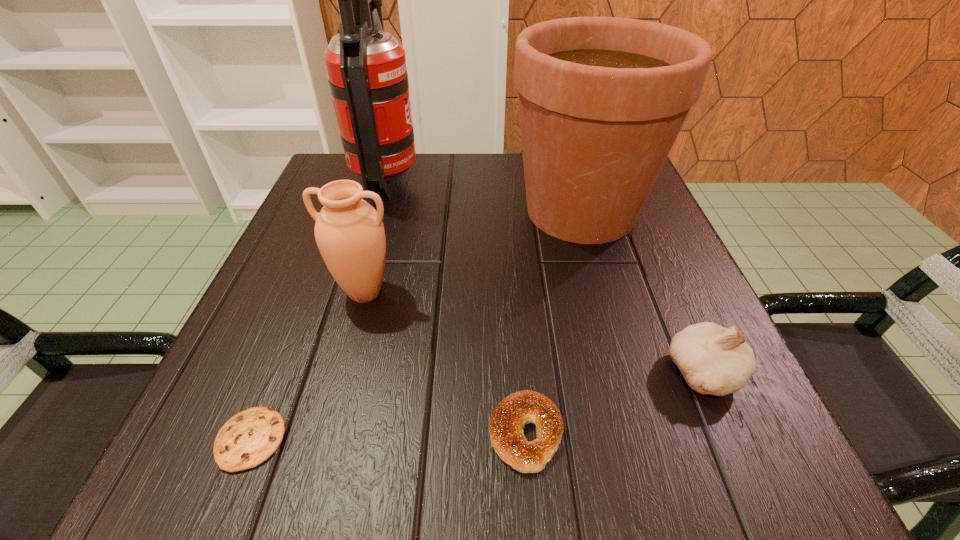
Identify the location of object that is the third nearest to the flowerpot. The width and height of the screenshot is (960, 540). (349, 232).

The height and width of the screenshot is (540, 960). I want to click on the fourth closest object relative to the flowerpot, so click(x=506, y=425).

The width and height of the screenshot is (960, 540). Find the location of `free point that satisfies the following two spatial constraints: 1. on the front side of the third tallest object; 2. on the left side of the fifth tallest object`. free point that satisfies the following two spatial constraints: 1. on the front side of the third tallest object; 2. on the left side of the fifth tallest object is located at coordinates (327, 434).

The height and width of the screenshot is (540, 960). Find the location of `vacant area that satisfies the following two spatial constraints: 1. on the back side of the second tallest object; 2. on the front label side of the fire extinguisher`. vacant area that satisfies the following two spatial constraints: 1. on the back side of the second tallest object; 2. on the front label side of the fire extinguisher is located at coordinates (571, 179).

This screenshot has width=960, height=540. Find the location of `free location that satisfies the following two spatial constraints: 1. on the back side of the bagel; 2. on the left side of the fourth tallest object`. free location that satisfies the following two spatial constraints: 1. on the back side of the bagel; 2. on the left side of the fourth tallest object is located at coordinates (521, 372).

Find the location of a particular element. The width and height of the screenshot is (960, 540). free space in the image that satisfies the following two spatial constraints: 1. on the back side of the third shortest object; 2. on the right side of the second shortest object is located at coordinates (521, 372).

Locate an element on the screen. Image resolution: width=960 pixels, height=540 pixels. free space in the image that satisfies the following two spatial constraints: 1. on the front label side of the fire extinguisher; 2. on the right side of the urn is located at coordinates (353, 293).

This screenshot has height=540, width=960. What are the coordinates of `vacant space that satisfies the following two spatial constraints: 1. on the back side of the flowerpot; 2. on the left side of the shortest object` in the screenshot? It's located at (342, 211).

The image size is (960, 540). I want to click on vacant space that satisfies the following two spatial constraints: 1. on the front label side of the tallest object; 2. on the left side of the garlic, so click(x=329, y=372).

Where is `vacant space that satisfies the following two spatial constraints: 1. on the front label side of the fire extinguisher; 2. on the right side of the bagel`? The width and height of the screenshot is (960, 540). vacant space that satisfies the following two spatial constraints: 1. on the front label side of the fire extinguisher; 2. on the right side of the bagel is located at coordinates (311, 434).